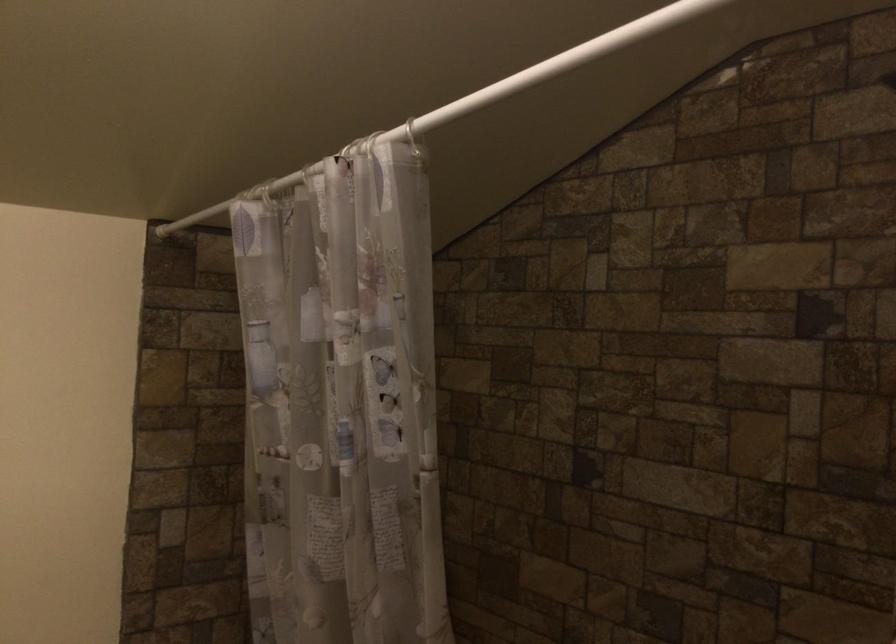
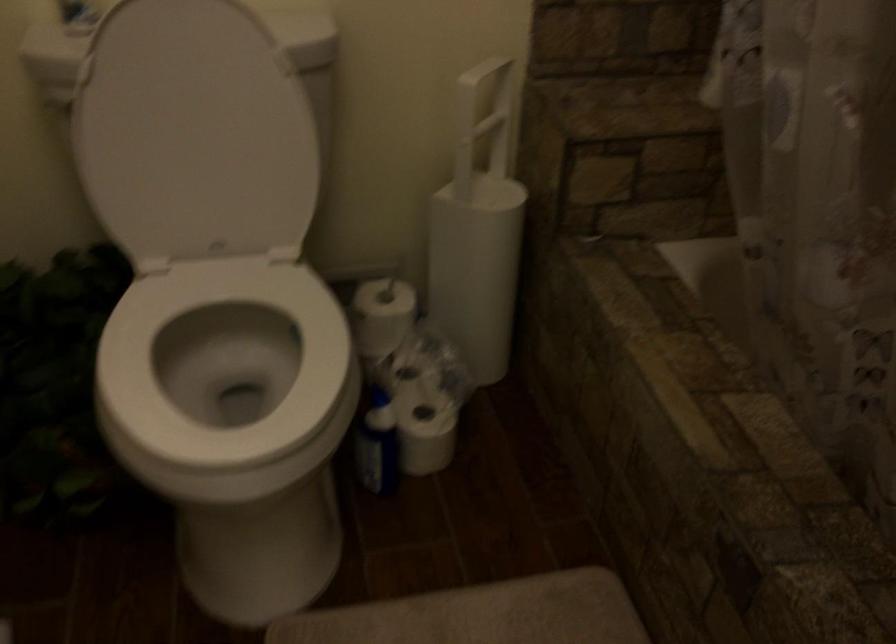
Based on the continuous images, in which direction is the camera rotating?

The camera's rotation is toward left-down.